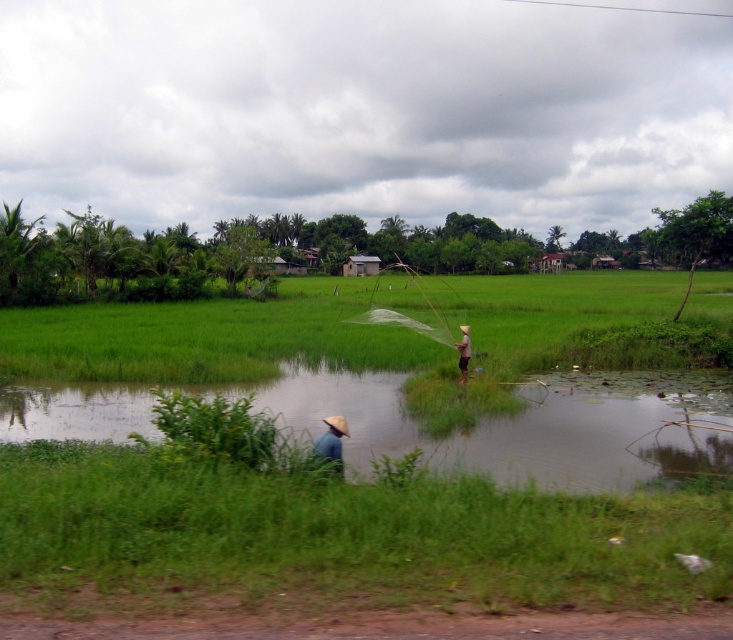
Which is behind, point (323, 456) or point (463, 358)?

The point (463, 358) is more distant.

Does point (335, 448) come closer to viewer compared to point (468, 356)?

Yes, point (335, 448) is in front of point (468, 356).

Where is `brown straw hat at lower center`? Image resolution: width=733 pixels, height=640 pixels. brown straw hat at lower center is located at coordinates pos(331,442).

Who is positioned more to the right, green grass field at center or brown straw hat at lower center?

Answer: green grass field at center is more to the right.

Is green grass field at center positioned in front of brown straw hat at lower center?

That is False.

Who is more distant from viewer, (210, 321) or (331, 428)?

Positioned behind is point (210, 321).

Where is `green grass field at center`? This screenshot has width=733, height=640. green grass field at center is located at coordinates (216, 337).

Is green grassy water at lower center behind light brown straw hat at center?

No, it is in front of light brown straw hat at center.

Find the location of a particular element. green grassy water at lower center is located at coordinates (530, 426).